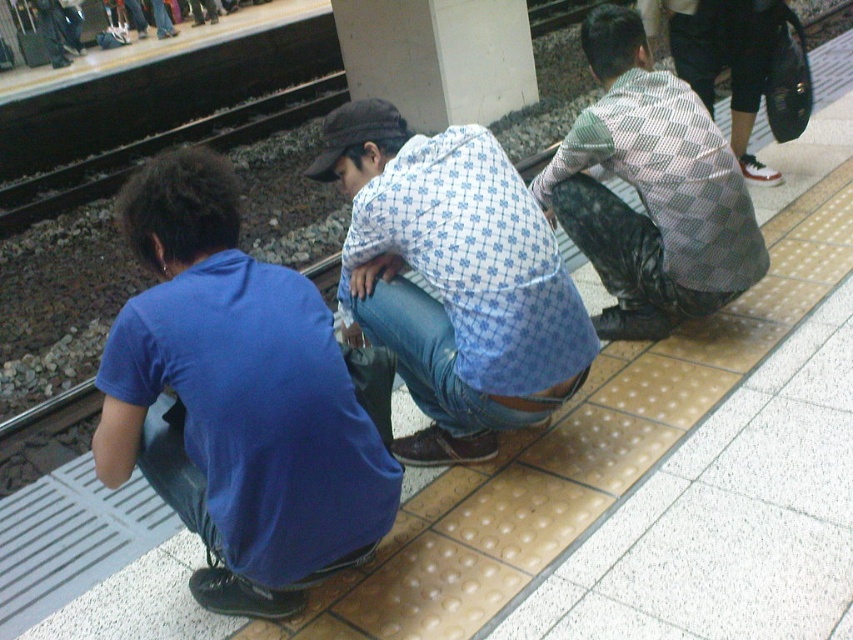
You are standing on the train station platform and see the blue cotton shirt at lower left and the checkered fabric shirt at center. Which person is positioned more to the left side of the platform?

The blue cotton shirt at lower left is positioned more to the left side of the platform than the checkered fabric shirt at center.

You are standing on the train station platform and see two people wearing shirts with patterns. The blue printed shirt at center and the checkered fabric shirt at center. Which of these two shirts is positioned lower on the platform?

The blue printed shirt at center is located below the checkered fabric shirt at center, so the blue printed shirt at center is positioned lower on the platform.